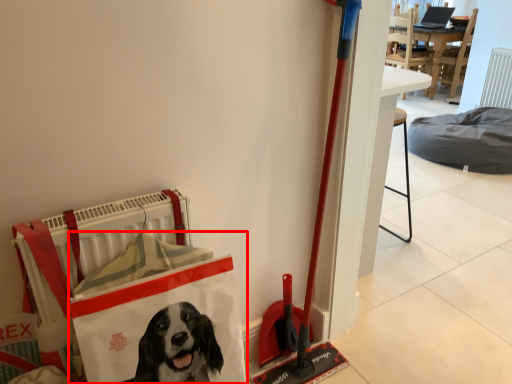
Question: From the image's perspective, what is the correct spatial relationship of shopping bag (annotated by the red box) in relation to dog bed?

Choices:
 (A) below
 (B) above

Answer: (A)